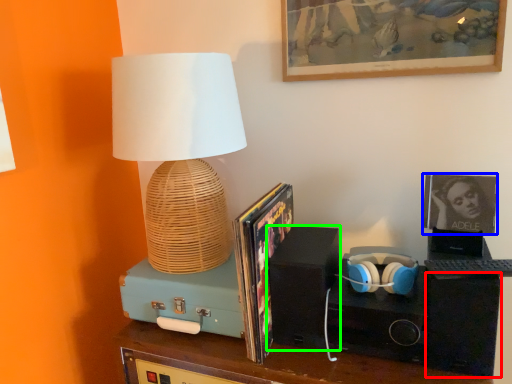
Question: Which object is the farthest from speaker (highlighted by a red box)? Choose among these: picture frame (highlighted by a blue box) or speaker (highlighted by a green box).

Choices:
 (A) picture frame
 (B) speaker

Answer: (B)